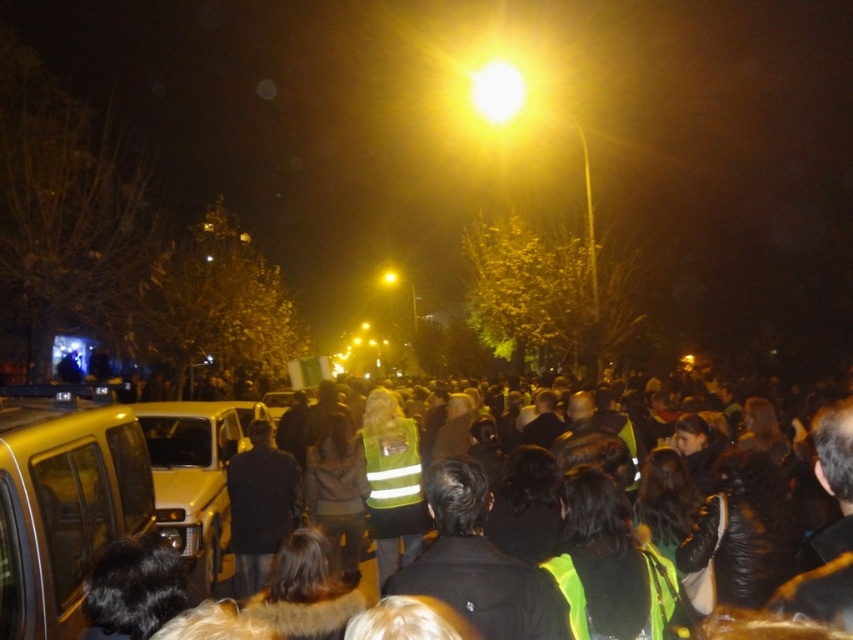
Question: Does reflective yellow vest at center have a smaller size compared to yellow matte taxi at lower left?

Choices:
 (A) yes
 (B) no

Answer: (A)

Question: Among these objects, which one is nearest to the camera?

Choices:
 (A) reflective yellow vest at center
 (B) yellow matte taxi at lower left

Answer: (A)

Question: Among these objects, which one is nearest to the camera?

Choices:
 (A) reflective yellow vest at center
 (B) metallic silver car at center

Answer: (A)

Question: Can you confirm if metallic gold taxi at lower left is positioned above metallic silver car at center?

Choices:
 (A) yes
 (B) no

Answer: (A)

Question: Estimate the real-world distances between objects in this image. Which object is closer to the reflective yellow vest at center?

Choices:
 (A) metallic silver car at center
 (B) yellow reflective vest at center

Answer: (A)

Question: Does dark fabric jacket at center have a greater width compared to metallic silver car at center?

Choices:
 (A) no
 (B) yes

Answer: (A)